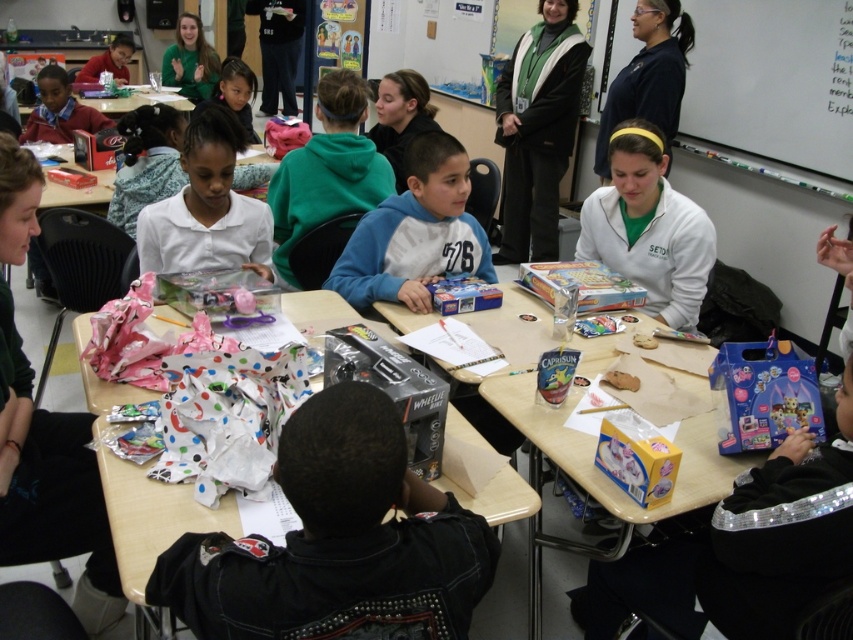
Question: Does white matte board game at center have a larger size compared to matte pink hairband at upper center?

Choices:
 (A) yes
 (B) no

Answer: (B)

Question: Among these points, which one is nearest to the camera?

Choices:
 (A) (517, 109)
 (B) (518, 502)
 (C) (627, 48)
 (D) (589, 442)

Answer: (B)

Question: Which object appears closest to the camera in this image?

Choices:
 (A) white paper at center
 (B) matte black laptop at upper left
 (C) green fleece hoodie at upper center

Answer: (A)

Question: Based on their relative distances, which object is farther from the whiteboard at upper right?

Choices:
 (A) white matte board game at center
 (B) wrapping paper at upper left
 (C) white paper at center
 (D) matte pink hairband at upper center

Answer: (B)

Question: Is the position of yellow cardboard table at center less distant than that of green woolen sweater at upper center?

Choices:
 (A) yes
 (B) no

Answer: (A)

Question: Does green matte shirt at upper center appear on the left side of wrapping paper at upper left?

Choices:
 (A) no
 (B) yes

Answer: (A)